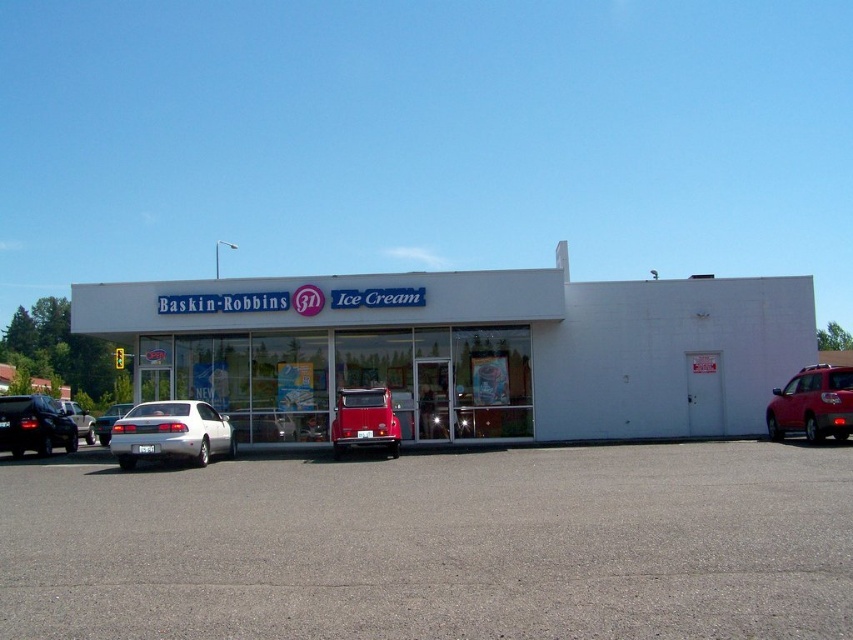
Based on the photo, is white glossy sedan at center positioned in front of metallic red van at center?

That is True.

Is point (138, 406) closer to viewer compared to point (339, 396)?

Yes, point (138, 406) is in front of point (339, 396).

Image resolution: width=853 pixels, height=640 pixels. Find the location of `white glossy sedan at center`. white glossy sedan at center is located at coordinates (171, 433).

In the scene shown: Does gray asphalt parking lot at lower center have a lesser width compared to shiny black sedan at left?

No.

I want to click on gray asphalt parking lot at lower center, so click(436, 547).

Does white matte building at center appear on the left side of shiny red suv at right?

No, white matte building at center is not to the left of shiny red suv at right.

Who is more forward, (242, 380) or (770, 408)?

Positioned in front is point (770, 408).

What are the coordinates of `white matte building at center` in the screenshot? It's located at (466, 349).